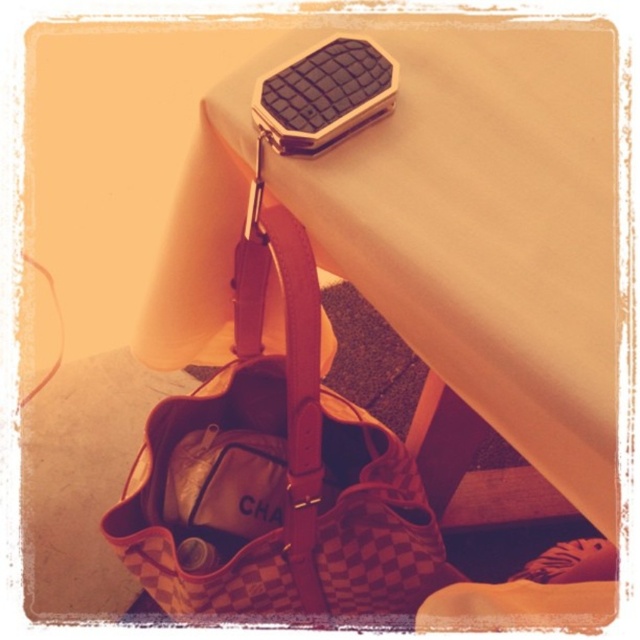
You are organizing a display of vintage items and need to place a new item on the beige surface. The new item must be placed exactly at the coordinates point (280, 476). What object is located at that point?

The point (280, 476) corresponds to the checkerboard fabric handbag at center.

You are organizing items on a table and need to place a new item between the black textured box at upper center and the leather strap at upper center. Based on their positions, where should you place the new item?

The black textured box at upper center is located above the leather strap at upper center, so you should place the new item between them by positioning it below the black textured box at upper center and above the leather strap at upper center.